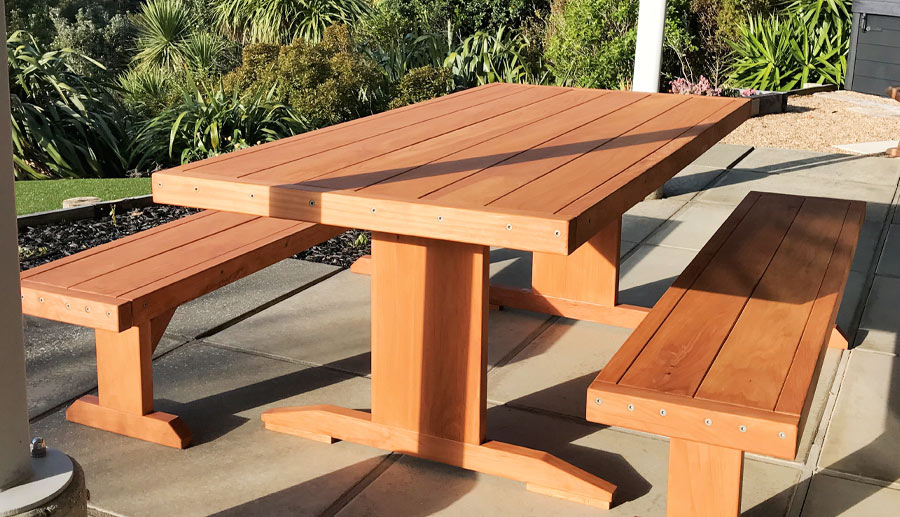
At what (x,y) coordinates should I click in order to perform the action: click on front legs  for bench. Please return your answer as a coordinate pair (x, y). Looking at the image, I should click on (119, 357), (698, 474).